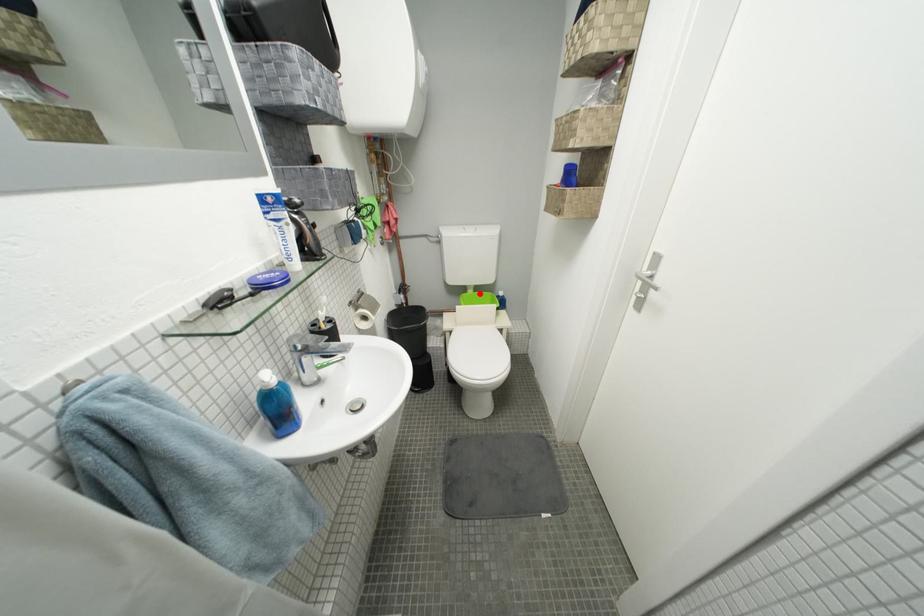
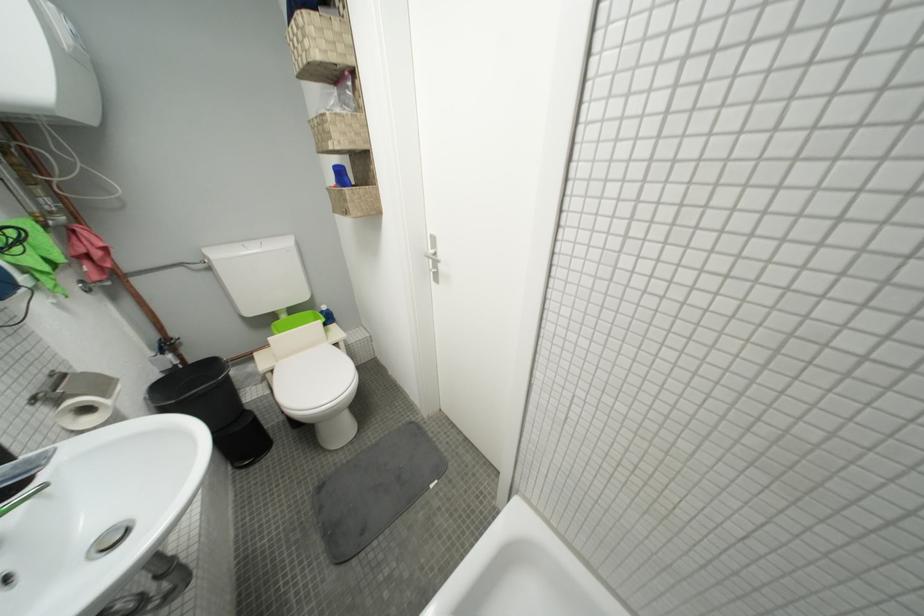
Question: I am providing you with two images of the same scene from different viewpoints. Image1 has a red point marked. In image2, the corresponding 3D location appears at what relative position? Reply with the corresponding letter.

Choices:
 (A) Closer
 (B) Farther

Answer: (A)